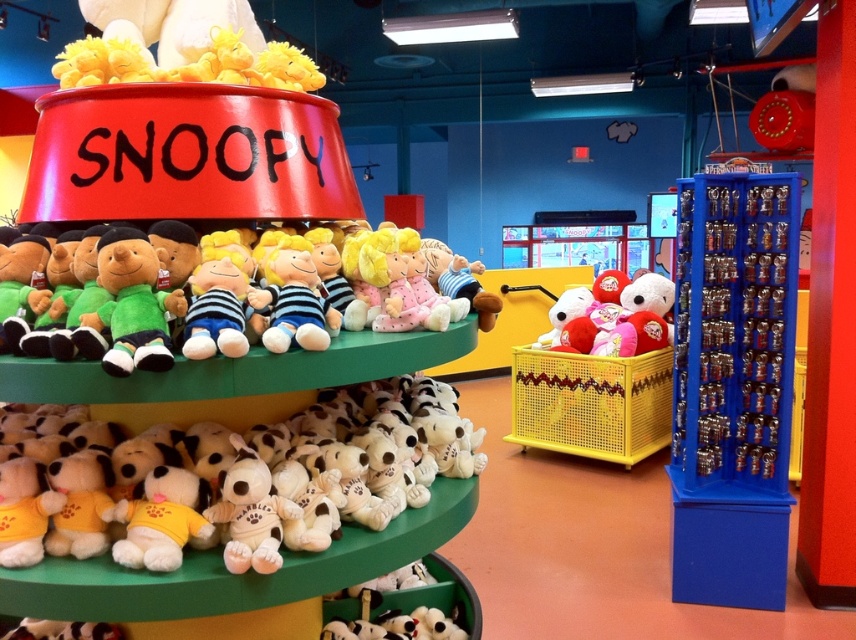
You are a customer in the store and want to locate the blue plastic keychain rack at right. Can you describe its location relative to the main Snoopy display?

The blue plastic keychain rack at right is located at the coordinates point (x=733, y=387), which is to the right side of the main Snoopy display.

You are a customer looking to buy a Snoopy plush toy. You see the white plush dog at lower center and the soft plush toys at center. Which one is closer to you?

The white plush dog at lower center is closer to you because the soft plush toys at center are positioned behind it.